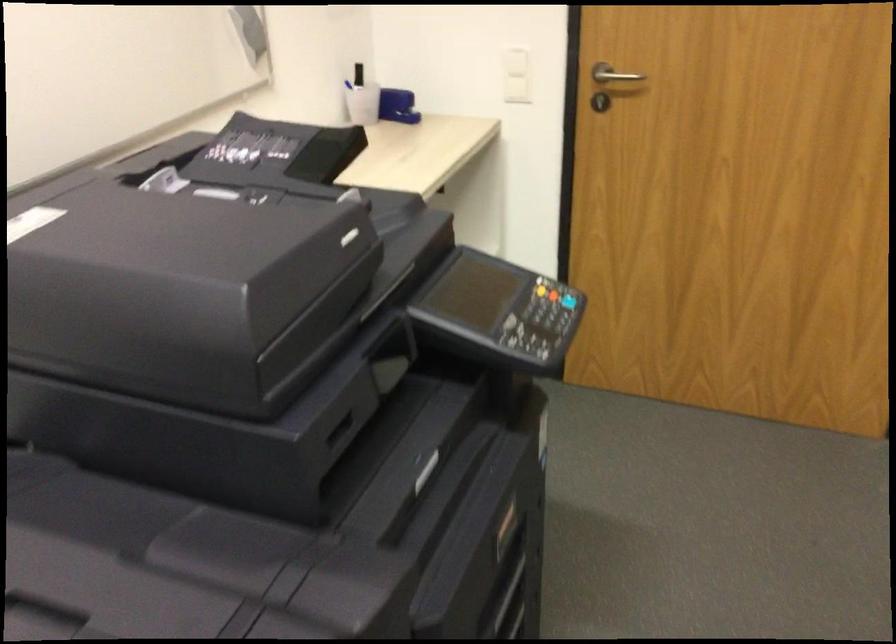
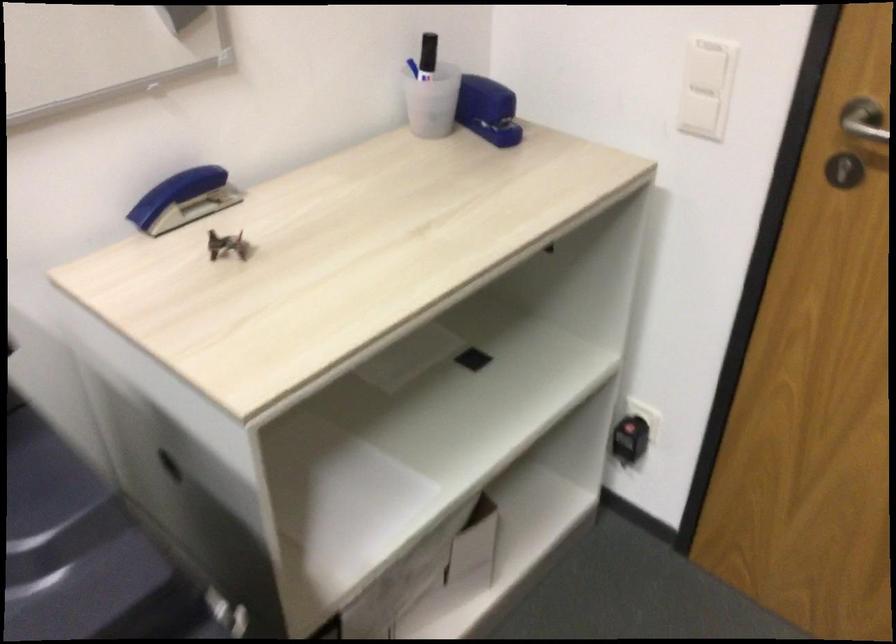
In the second image, find the point that corresponds to (x=403, y=102) in the first image.

(487, 109)